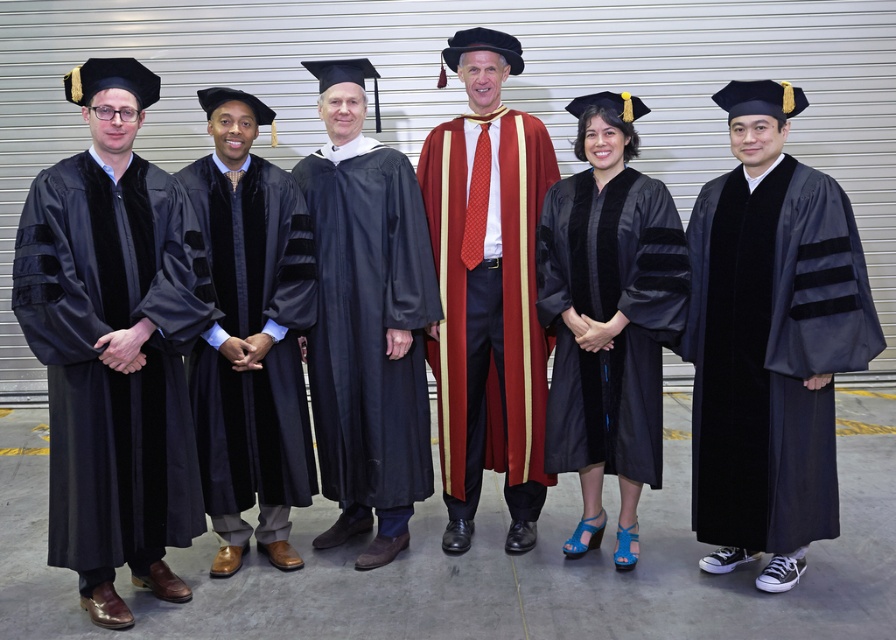
Can you confirm if velvet black graduation gown at center is positioned below satin black gown at center?

Yes.

Is velvet black graduation gown at center shorter than satin black gown at center?

No.

Who is more distant from viewer, (202, 211) or (645, 452)?

Positioned behind is point (202, 211).

The width and height of the screenshot is (896, 640). What are the coordinates of `velvet black graduation gown at center` in the screenshot? It's located at (247, 339).

Is shiny black gown at center closer to camera compared to satin black gown at center?

No, shiny black gown at center is behind satin black gown at center.

Does shiny black gown at center appear under satin black gown at center?

Indeed, shiny black gown at center is positioned under satin black gown at center.

Is point (309, 204) less distant than point (597, 392)?

No.

At what (x,y) coordinates should I click in order to perform the action: click on shiny black gown at center. Please return your answer as a coordinate pair (x, y). This screenshot has width=896, height=640. Looking at the image, I should click on [x=369, y=326].

Is matte black gown at left to the left of maroon velvet gown at center from the viewer's perspective?

Indeed, matte black gown at left is positioned on the left side of maroon velvet gown at center.

Is matte black gown at left positioned behind maroon velvet gown at center?

No, matte black gown at left is in front of maroon velvet gown at center.

Between point (84, 401) and point (454, 346), which one is positioned behind?

Positioned behind is point (454, 346).

The width and height of the screenshot is (896, 640). What are the coordinates of `matte black gown at left` in the screenshot? It's located at (106, 365).